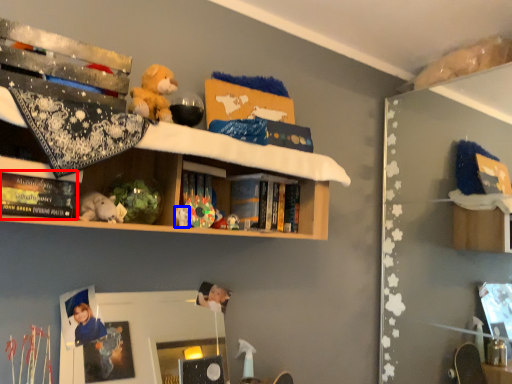
Question: Among these objects, which one is nearest to the camera, book (highlighted by a red box) or toy (highlighted by a blue box)?

Choices:
 (A) book
 (B) toy

Answer: (A)